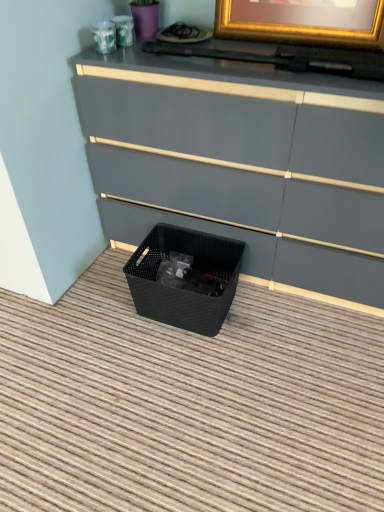
This screenshot has width=384, height=512. Find the location of `black woven basket at lower center`. black woven basket at lower center is located at coordinates (185, 278).

The width and height of the screenshot is (384, 512). What do you see at coordinates (185, 278) in the screenshot?
I see `black woven basket at lower center` at bounding box center [185, 278].

Describe the element at coordinates (242, 163) in the screenshot. I see `matte black storage bin at lower left` at that location.

Where is `matte black storage bin at lower left`? This screenshot has width=384, height=512. matte black storage bin at lower left is located at coordinates (242, 163).

This screenshot has width=384, height=512. I want to click on black woven basket at lower center, so click(x=185, y=278).

Is black woven basket at lower center at the left side of matte black storage bin at lower left?

Correct, you'll find black woven basket at lower center to the left of matte black storage bin at lower left.

Which object is more forward, black woven basket at lower center or matte black storage bin at lower left?

matte black storage bin at lower left is closer to the camera.

Which is farther from the camera, (x=189, y=327) or (x=102, y=66)?

The point (x=189, y=327) is more distant.

From the image's perspective, who appears lower, black woven basket at lower center or matte black storage bin at lower left?

black woven basket at lower center.

From a real-world perspective, which is physically above, black woven basket at lower center or matte black storage bin at lower left?

matte black storage bin at lower left is physically above.

Which object is thinner, black woven basket at lower center or matte black storage bin at lower left?

black woven basket at lower center is thinner.

Based on the photo, can you confirm if black woven basket at lower center is shorter than matte black storage bin at lower left?

Correct, black woven basket at lower center is not as tall as matte black storage bin at lower left.

Considering the sizes of objects black woven basket at lower center and matte black storage bin at lower left in the image provided, who is smaller, black woven basket at lower center or matte black storage bin at lower left?

With smaller size is black woven basket at lower center.

Would you say black woven basket at lower center is inside or outside matte black storage bin at lower left?

black woven basket at lower center is spatially situated outside matte black storage bin at lower left.

Is there a large distance between black woven basket at lower center and matte black storage bin at lower left?

No.

Could you tell me if black woven basket at lower center is facing matte black storage bin at lower left?

No, black woven basket at lower center is not turned towards matte black storage bin at lower left.

Can you tell me how much black woven basket at lower center and matte black storage bin at lower left differ in facing direction?

1.73 degrees.

How much distance is there between black woven basket at lower center and matte black storage bin at lower left?

The distance of black woven basket at lower center from matte black storage bin at lower left is 10.96 inches.

You are a GUI agent. You are given a task and a screenshot of the screen. Output one action in this format:
    pyautogui.click(x=<x>, y=<y>)
    Task: Click on the basket container below the matte black storage bin at lower left (from the image's perspective)
    This screenshot has height=512, width=384.
    Given the screenshot: What is the action you would take?
    (x=185, y=278)

Which object is positioned more to the right, matte black storage bin at lower left or black woven basket at lower center?

matte black storage bin at lower left is more to the right.

Considering the relative positions of matte black storage bin at lower left and black woven basket at lower center in the image provided, is matte black storage bin at lower left behind black woven basket at lower center?

That is False.

Which is nearer, (199, 120) or (183, 325)?

Point (199, 120) appears to be closer to the viewer than point (183, 325).

From the image's perspective, relative to black woven basket at lower center, is matte black storage bin at lower left above or below?

matte black storage bin at lower left is above black woven basket at lower center.

Consider the image. From a real-world perspective, is matte black storage bin at lower left physically below black woven basket at lower center?

No, from a real-world perspective, matte black storage bin at lower left is not beneath black woven basket at lower center.

Is matte black storage bin at lower left thinner than black woven basket at lower center?

No.

Considering the sizes of matte black storage bin at lower left and black woven basket at lower center in the image, is matte black storage bin at lower left taller or shorter than black woven basket at lower center?

Clearly, matte black storage bin at lower left is taller compared to black woven basket at lower center.

Between matte black storage bin at lower left and black woven basket at lower center, which one has smaller size?

black woven basket at lower center is smaller.

Is matte black storage bin at lower left outside of black woven basket at lower center?

Yes, matte black storage bin at lower left is located beyond the bounds of black woven basket at lower center.

In the scene shown: Is there a large distance between matte black storage bin at lower left and black woven basket at lower center?

Actually, matte black storage bin at lower left and black woven basket at lower center are a little close together.

Is matte black storage bin at lower left oriented towards black woven basket at lower center?

Yes, matte black storage bin at lower left faces towards black woven basket at lower center.

Can you tell me how much matte black storage bin at lower left and black woven basket at lower center differ in facing direction?

1.73 degrees separate the facing orientations of matte black storage bin at lower left and black woven basket at lower center.

How much distance is there between matte black storage bin at lower left and black woven basket at lower center?

They are 27.85 centimeters apart.

The width and height of the screenshot is (384, 512). What are the coordinates of `the chest of drawers above the black woven basket at lower center (from the image's perspective)` in the screenshot? It's located at (242, 163).

Locate an element on the screen. The image size is (384, 512). the chest of drawers in front of the black woven basket at lower center is located at coordinates (242, 163).

What are the coordinates of `basket container on the left of matte black storage bin at lower left` in the screenshot? It's located at (185, 278).